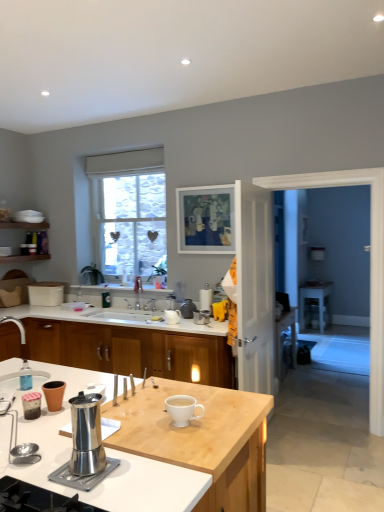
What is the approximate height of white paper towel holder at center, which ranks as the 1th appliance in back-to-front order?

The height of white paper towel holder at center, which ranks as the 1th appliance in back-to-front order, is 13.76 inches.

Where is `white paper towel holder at center, placed as the first appliance when sorted from right to left`? The width and height of the screenshot is (384, 512). white paper towel holder at center, placed as the first appliance when sorted from right to left is located at coordinates (206, 298).

The width and height of the screenshot is (384, 512). Describe the element at coordinates (129, 350) in the screenshot. I see `wooden cabinet at center` at that location.

Measure the distance between point (124, 316) and camera.

A distance of 3.99 meters exists between point (124, 316) and camera.

In order to face white ceramic sink at center, should I rotate leftwards or rightwards?

Turn left approximately 9.242 degrees to face it.

How much space does polished stainless steel coffee maker at lower left, the first appliance positioned from the front, occupy horizontally?

6.13 inches.

Find the location of a particular element. polished stainless steel coffee maker at lower left, which appears as the 1th appliance when viewed from the left is located at coordinates (85, 446).

Image resolution: width=384 pixels, height=512 pixels. Find the location of `white paper towel holder at center, placed as the first appliance when sorted from right to left`. white paper towel holder at center, placed as the first appliance when sorted from right to left is located at coordinates (206, 298).

From the picture: Considering the sizes of objects matte white desk at right and white glossy door at center, which is counted as the second screen door, starting from the right, in the image provided, who is thinner, matte white desk at right or white glossy door at center, which is counted as the second screen door, starting from the right,?

white glossy door at center, which is counted as the second screen door, starting from the right, is thinner.

Measure the distance between matte white desk at right and white glossy door at center, which is counted as the second screen door, starting from the right.

matte white desk at right is 3.05 meters from white glossy door at center, which is counted as the second screen door, starting from the right.

From the image's perspective, which object appears higher, matte white desk at right or white glossy door at center, positioned as the first screen door in left-to-right order?

white glossy door at center, positioned as the first screen door in left-to-right order, appears higher in the image.

Consider the image. Considering the relative positions of white glossy door at center, which is counted as the second screen door, starting from the right, and wooden cabinet at center in the image provided, is white glossy door at center, which is counted as the second screen door, starting from the right, to the right of wooden cabinet at center from the viewer's perspective?

Yes.

Consider the image. Is white glossy door at center, which is counted as the second screen door, starting from the right, completely or partially outside of wooden cabinet at center?

Yes, white glossy door at center, which is counted as the second screen door, starting from the right, is not within wooden cabinet at center.

Is clear glass window at upper left taller than white glossy countertop at center, which is counted as the first countertop, starting from the back?

Yes, clear glass window at upper left is taller than white glossy countertop at center, which is counted as the first countertop, starting from the back.

The height and width of the screenshot is (512, 384). What are the coordinates of `the 1st countertop below the clear glass window at upper left (from a real-world perspective)` in the screenshot? It's located at (115, 318).

Is clear glass window at upper left in front of or behind white glossy countertop at center, the 2th countertop positioned from the front, in the image?

Clearly, clear glass window at upper left is behind white glossy countertop at center, the 2th countertop positioned from the front.

Considering the positions of point (319, 318) and point (65, 386), is point (319, 318) closer or farther from the camera than point (65, 386)?

Point (319, 318) is positioned farther from the camera compared to point (65, 386).

Is matte white desk at right with matte brown cup at center, which appears as the 2th coffee cup when viewed from the right?

No, matte white desk at right is not in contact with matte brown cup at center, which appears as the 2th coffee cup when viewed from the right.

Is matte white desk at right taller or shorter than matte brown cup at center, which appears as the 1th coffee cup when viewed from the back?

In the image, matte white desk at right appears to be taller than matte brown cup at center, which appears as the 1th coffee cup when viewed from the back.

Is matte white desk at right smaller than matte brown cup at center, which appears as the 1th coffee cup when viewed from the back?

Incorrect, matte white desk at right is not smaller in size than matte brown cup at center, which appears as the 1th coffee cup when viewed from the back.

From the picture: Considering the positions of objects white glossy countertop at center, the 2th countertop positioned from the front, and matte white desk at right in the image provided, who is more to the right, white glossy countertop at center, the 2th countertop positioned from the front, or matte white desk at right?

matte white desk at right.

Considering the sizes of objects white glossy countertop at center, which is counted as the first countertop, starting from the back, and matte white desk at right in the image provided, who is taller, white glossy countertop at center, which is counted as the first countertop, starting from the back, or matte white desk at right?

matte white desk at right.

Could you tell me if white glossy countertop at center, which is counted as the first countertop, starting from the back, is facing matte white desk at right?

No.

Which is behind, point (62, 381) or point (264, 254)?

The point (264, 254) is behind.

From a real-world perspective, is matte brown cup at center, the first coffee cup viewed from the left, above or below white glossy door at center, which is counted as the second screen door, starting from the right?

Clearly, from a real-world perspective, matte brown cup at center, the first coffee cup viewed from the left, is below white glossy door at center, which is counted as the second screen door, starting from the right.

Is matte brown cup at center, which appears as the 2th coffee cup when viewed from the right, facing away from white glossy door at center, which is counted as the second screen door, starting from the right?

No.

Is matte brown cup at center, the 2th coffee cup in the front-to-back sequence, positioned beyond the bounds of white glossy door at center, which is counted as the second screen door, starting from the right?

Yes, matte brown cup at center, the 2th coffee cup in the front-to-back sequence, is outside of white glossy door at center, which is counted as the second screen door, starting from the right.

From the image's perspective, is white glossy screen door at right, which is counted as the first screen door, starting from the right, above or below matte white desk at right?

white glossy screen door at right, which is counted as the first screen door, starting from the right, is situated higher than matte white desk at right in the image.

Based on the photo, considering the sizes of objects white glossy screen door at right, which is counted as the first screen door, starting from the right, and matte white desk at right in the image provided, who is smaller, white glossy screen door at right, which is counted as the first screen door, starting from the right, or matte white desk at right?

Smaller between the two is matte white desk at right.

Consider the image. Which is less distant, (248, 220) or (323, 307)?

Point (248, 220) is positioned closer to the camera compared to point (323, 307).

Which is more to the left, white glossy screen door at right, which is counted as the first screen door, starting from the right, or matte white desk at right?

white glossy screen door at right, which is counted as the first screen door, starting from the right, is more to the left.

Find the location of a particular element. The width and height of the screenshot is (384, 512). desk on the right side of white glossy door at center, which is counted as the second screen door, starting from the right is located at coordinates (315, 302).

This screenshot has height=512, width=384. Identify the location of cabinetry that is on the left side of white glossy door at center, positioned as the first screen door in left-to-right order. (129, 350).

Estimate the real-world distances between objects in this image. Which object is further from white ceramic sink at center, clear glass window at upper left or matte white desk at right?

matte white desk at right.

From the image, which object appears to be nearer to matte brown cup at center, the first coffee cup viewed from the left, white ceramic sink at center or polished stainless steel coffee maker at lower left, which appears as the second appliance when viewed from the right?

The object closer to matte brown cup at center, the first coffee cup viewed from the left, is polished stainless steel coffee maker at lower left, which appears as the second appliance when viewed from the right.

From the image, which object appears to be nearer to white paper towel holder at center, which ranks as the 1th appliance in back-to-front order, light wood countertop at center, placed as the 1th countertop when sorted from front to back, or clear glass window at upper left?

clear glass window at upper left lies closer to white paper towel holder at center, which ranks as the 1th appliance in back-to-front order, than the other object.

Estimate the real-world distances between objects in this image. Which object is further from light wood countertop at center, the 2th countertop from the back, clear glass window at upper left or wooden cabinet at center?

clear glass window at upper left is positioned further to the anchor light wood countertop at center, the 2th countertop from the back.

When comparing their distances from matte white desk at right, does wooden cabinet at center or white ceramic sink at center seem closer?

white ceramic sink at center.

Estimate the real-world distances between objects in this image. Which object is further from white glossy door at center, positioned as the first screen door in left-to-right order, white glossy countertop at center, the 2th countertop positioned from the front, or matte white desk at right?

matte white desk at right is positioned further to the anchor white glossy door at center, positioned as the first screen door in left-to-right order.

Looking at this image, based on their spatial positions, is white glossy countertop at center, the 2th countertop positioned from the front, or matte brown cup at center, the first coffee cup viewed from the left, further from white glossy mug at center, the 2th coffee cup in the left-to-right sequence?

white glossy countertop at center, the 2th countertop positioned from the front.

Considering their positions, is polished stainless steel coffee maker at lower left, acting as the 2th appliance starting from the back, positioned further to wooden cabinet at center than white paper towel holder at center, which ranks as the second appliance in front-to-back order?

polished stainless steel coffee maker at lower left, acting as the 2th appliance starting from the back.

You are a GUI agent. You are given a task and a screenshot of the screen. Output one action in this format:
    pyautogui.click(x=<x>, y=<y>)
    Task: Click on the appliance between light wood countertop at center, placed as the 1th countertop when sorted from front to back, and white ceramic sink at center, along the z-axis
    Image resolution: width=384 pixels, height=512 pixels.
    Given the screenshot: What is the action you would take?
    pyautogui.click(x=85, y=446)

Where is `countertop located between polished stainless steel coffee maker at lower left, acting as the 2th appliance starting from the back, and matte white desk at right in the depth direction`? The image size is (384, 512). countertop located between polished stainless steel coffee maker at lower left, acting as the 2th appliance starting from the back, and matte white desk at right in the depth direction is located at coordinates (115, 318).

Identify the location of screen door between polished stainless steel coffee maker at lower left, acting as the 2th appliance starting from the back, and white glossy screen door at right, which is counted as the first screen door, starting from the right, from front to back. (255, 287).

The height and width of the screenshot is (512, 384). I want to click on cabinetry between white glossy mug at center, placed as the 1th coffee cup when sorted from front to back, and matte white desk at right from front to back, so click(129, 350).